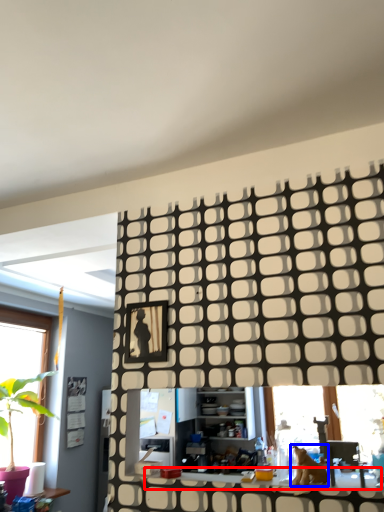
Question: Which object appears closest to the camera in this image, counter top (highlighted by a red box) or animal (highlighted by a blue box)?

Choices:
 (A) counter top
 (B) animal

Answer: (A)